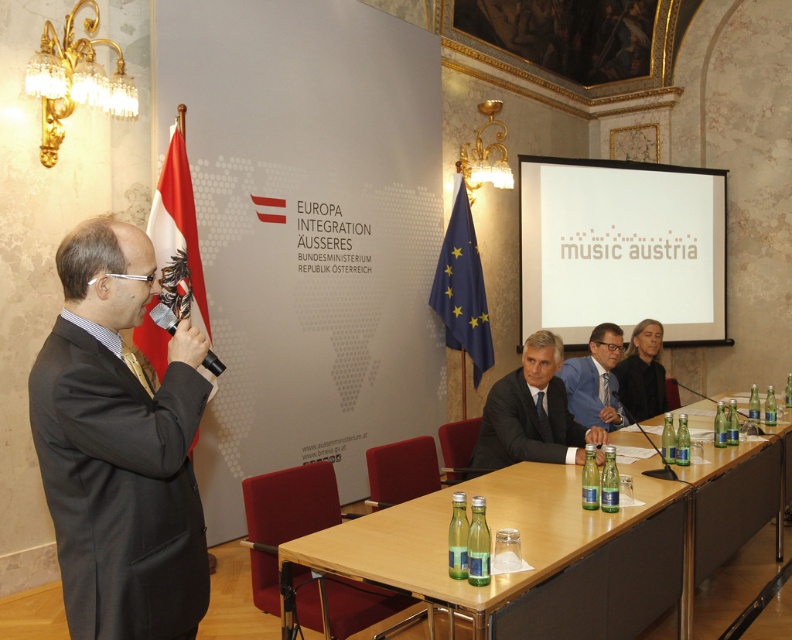
Question: Does dark blue fabric business suit at center have a larger size compared to blue textured suit at center?

Choices:
 (A) yes
 (B) no

Answer: (A)

Question: Which of these objects is positioned farthest from the wooden table at center?

Choices:
 (A) black suit at center
 (B) dark blue fabric business suit at center
 (C) white matte screen at upper center
 (D) black matte suit at left

Answer: (C)

Question: Which of the following is the closest to the observer?

Choices:
 (A) (591, 358)
 (B) (661, 384)
 (C) (345, 572)

Answer: (C)

Question: Which object is positioned closest to the black matte suit at left?

Choices:
 (A) dark blue fabric business suit at center
 (B) blue textured suit at center
 (C) wooden table at center

Answer: (C)

Question: Is black matte suit at left closer to camera compared to black suit at center?

Choices:
 (A) no
 (B) yes

Answer: (B)

Question: Is white matte screen at upper center behind wooden table at center?

Choices:
 (A) yes
 (B) no

Answer: (A)